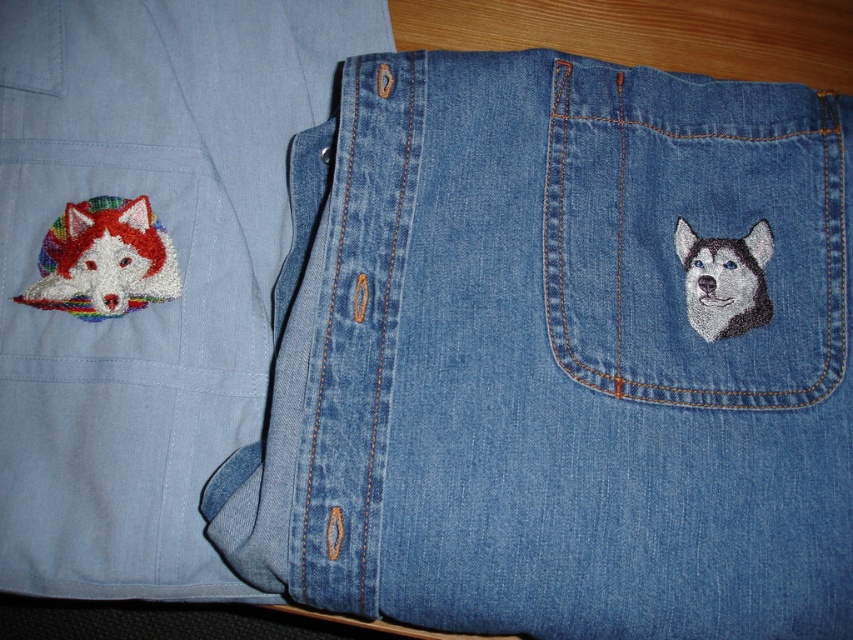
Question: Is denim at upper right wider than matte denim shirt at left?

Choices:
 (A) no
 (B) yes

Answer: (B)

Question: Among these points, which one is nearest to the camera?

Choices:
 (A) (734, 316)
 (B) (90, 138)
 (C) (595, 326)

Answer: (C)

Question: Which object is positioned closest to the denim at upper right?

Choices:
 (A) white fur dog at upper right
 (B) matte denim shirt at left

Answer: (A)

Question: Can you confirm if matte denim shirt at left is bigger than white fur dog at upper right?

Choices:
 (A) no
 (B) yes

Answer: (B)

Question: Which of the following is the farthest from the observer?

Choices:
 (A) (555, 390)
 (B) (149, 243)

Answer: (B)

Question: Is denim at upper right to the right of multicolored embroidered dog at left from the viewer's perspective?

Choices:
 (A) yes
 (B) no

Answer: (A)